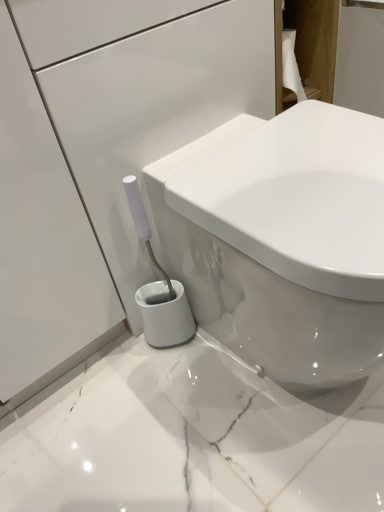
Question: Considering the positions of white glossy toilet at center and wooden cabinet at upper right in the image, is white glossy toilet at center wider or thinner than wooden cabinet at upper right?

Choices:
 (A) wide
 (B) thin

Answer: (A)

Question: From a real-world perspective, is white glossy toilet at center positioned above or below wooden cabinet at upper right?

Choices:
 (A) above
 (B) below

Answer: (B)

Question: Based on their sizes in the image, would you say white glossy toilet at center is bigger or smaller than wooden cabinet at upper right?

Choices:
 (A) small
 (B) big

Answer: (B)

Question: From the image's perspective, is wooden cabinet at upper right positioned above or below white glossy toilet at center?

Choices:
 (A) below
 (B) above

Answer: (B)

Question: Is wooden cabinet at upper right bigger or smaller than white glossy toilet at center?

Choices:
 (A) small
 (B) big

Answer: (A)

Question: Is wooden cabinet at upper right wider or thinner than white glossy toilet at center?

Choices:
 (A) thin
 (B) wide

Answer: (A)

Question: In the image, is wooden cabinet at upper right positioned in front of or behind white glossy toilet at center?

Choices:
 (A) front
 (B) behind

Answer: (B)